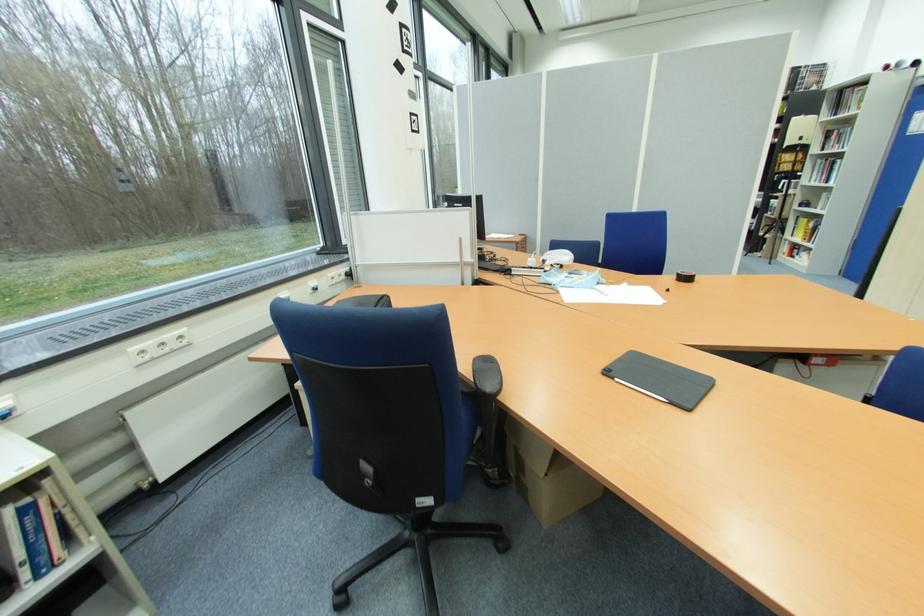
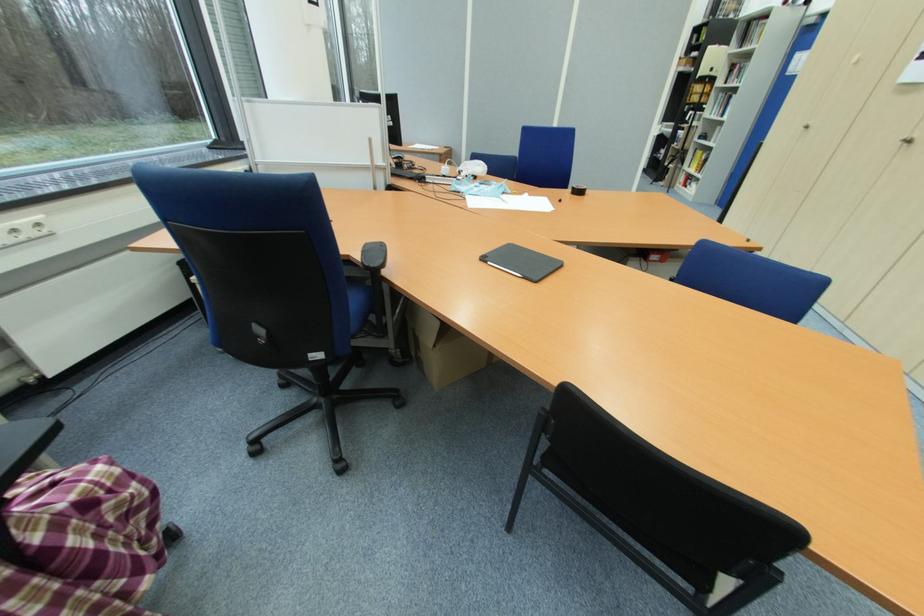
Locate, in the second image, the point that corresponds to pixel 536 269 in the first image.

(447, 177)